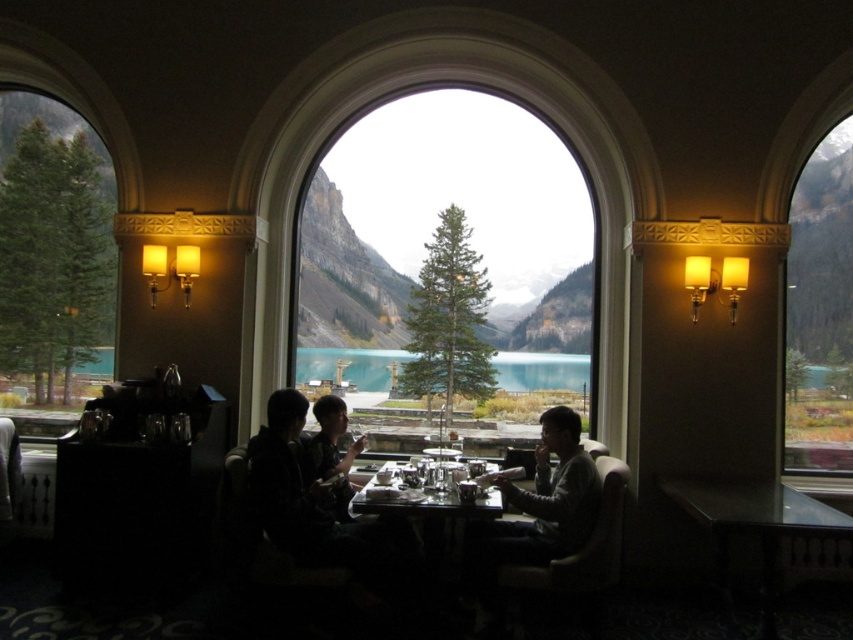
Can you confirm if turquoise glass lake at center is wider than metallic silver dinnerware at center?

Yes.

Does point (302, 369) come closer to viewer compared to point (456, 481)?

No, (302, 369) is further to viewer.

What do you see at coordinates (351, 365) in the screenshot? The width and height of the screenshot is (853, 640). I see `turquoise glass lake at center` at bounding box center [351, 365].

At what (x,y) coordinates should I click in order to perform the action: click on turquoise glass lake at center. Please return your answer as a coordinate pair (x, y). The height and width of the screenshot is (640, 853). Looking at the image, I should click on (351, 365).

Does dark gray hoodie at center come behind turquoise glass lake at center?

No, dark gray hoodie at center is in front of turquoise glass lake at center.

Is dark gray hoodie at center to the left of turquoise glass lake at center from the viewer's perspective?

Correct, you'll find dark gray hoodie at center to the left of turquoise glass lake at center.

Describe the element at coordinates (294, 486) in the screenshot. The width and height of the screenshot is (853, 640). I see `dark gray hoodie at center` at that location.

This screenshot has width=853, height=640. In order to click on dark gray hoodie at center in this screenshot , I will do `click(294, 486)`.

You are a GUI agent. You are given a task and a screenshot of the screen. Output one action in this format:
    pyautogui.click(x=<x>, y=<y>)
    Task: Click on the transparent glass window at center
    Image resolution: width=853 pixels, height=640 pixels.
    Given the screenshot: What is the action you would take?
    pyautogui.click(x=438, y=221)

Where is `transparent glass window at center`? transparent glass window at center is located at coordinates (438, 221).